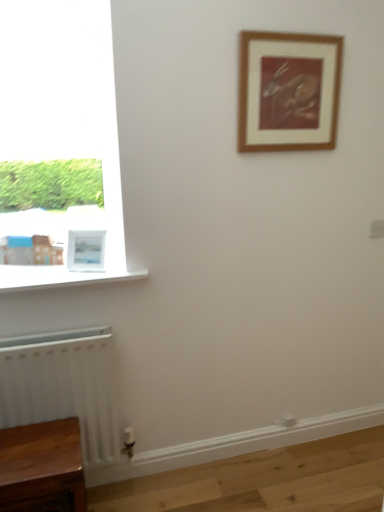
Question: From the image's perspective, is wooden table at lower left positioned above or below white glossy window sill at lower left?

Choices:
 (A) below
 (B) above

Answer: (A)

Question: Looking at their shapes, would you say wooden table at lower left is wider or thinner than white glossy window sill at lower left?

Choices:
 (A) wide
 (B) thin

Answer: (B)

Question: Which object is the farthest from the white matte radiator at lower left?

Choices:
 (A) white matte picture frame at lower left, which is the second picture frame from right to left
 (B) white glossy window sill at lower left
 (C) wooden framed print at upper center, acting as the first picture frame starting from the top
 (D) wooden table at lower left

Answer: (C)

Question: Which of these objects is positioned farthest from the white matte radiator at lower left?

Choices:
 (A) wooden framed print at upper center, acting as the first picture frame starting from the top
 (B) white glossy window sill at lower left
 (C) white matte picture frame at lower left, the second picture frame viewed from the top
 (D) wooden table at lower left

Answer: (A)